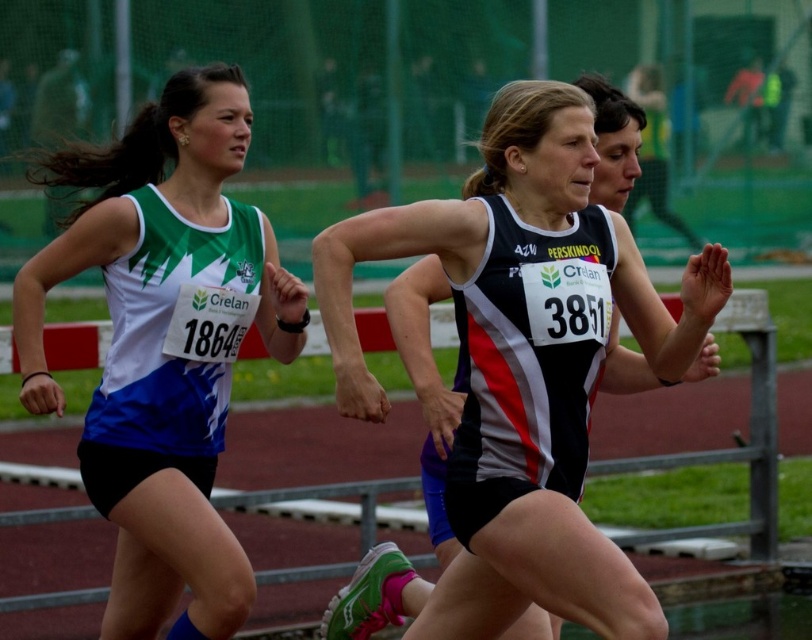
Question: Observing the image, what is the correct spatial positioning of black and white athletic top at center in reference to matte green and white tank top at left?

Choices:
 (A) left
 (B) right

Answer: (B)

Question: Which of the following is the farthest from the observer?

Choices:
 (A) (504, 214)
 (B) (212, 468)

Answer: (B)

Question: Can you confirm if black and white athletic top at center is wider than matte green and white tank top at left?

Choices:
 (A) yes
 (B) no

Answer: (A)

Question: Is black and white athletic top at center thinner than matte green and white tank top at left?

Choices:
 (A) yes
 (B) no

Answer: (B)